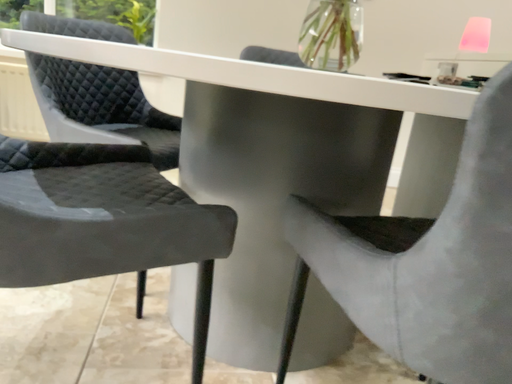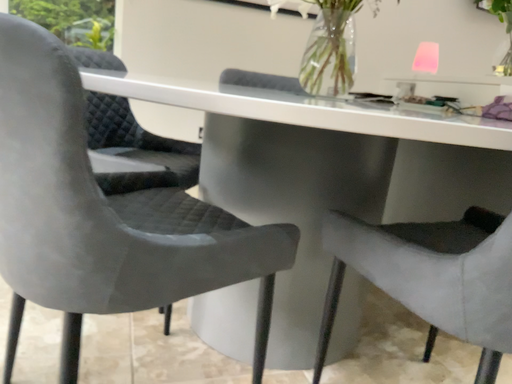
Question: Which way did the camera rotate in the video?

Choices:
 (A) rotated left
 (B) rotated right

Answer: (B)